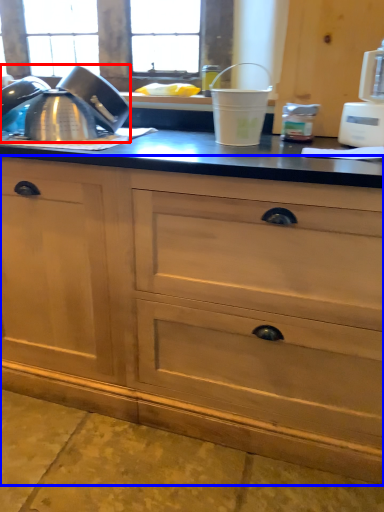
Question: Which of the following is the farthest to the observer, tea pot (highlighted by a red box) or cabinetry (highlighted by a blue box)?

Choices:
 (A) tea pot
 (B) cabinetry

Answer: (A)